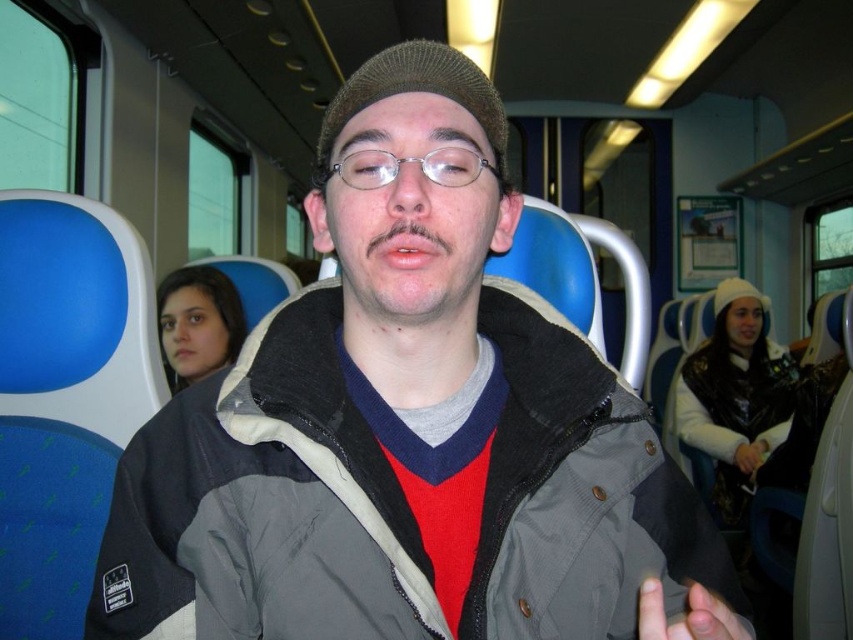
In the scene shown: You are standing in the train carriage and want to find the matte gray jacket at center. According to the coordinates provided, where should you look to locate it?

The matte gray jacket at center is located at point 0.673 on the horizontal axis and 0.474 on the vertical axis, so you should look towards the middle right area of the image where the coordinates intersect.

Based on the photo, you are a photographer standing in the train carriage. You want to take a photo of the matte gray jacket at center and the smooth skin hand at lower right. However, you can only focus on one of them clearly. Which object should you choose to ensure it is in focus, given that you can only focus on the closer object?

You should focus on the matte gray jacket at center because it is closer to you than the smooth skin hand at lower right, so it will be in focus while the other may appear blurry.